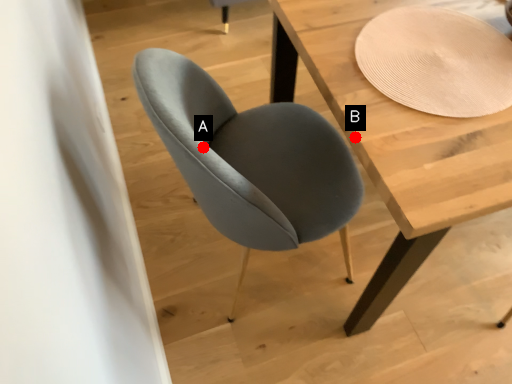
Question: Two points are circled on the image, labeled by A and B beside each circle. Which point is closer to the camera taking this photo?

Choices:
 (A) A is closer
 (B) B is closer

Answer: (A)